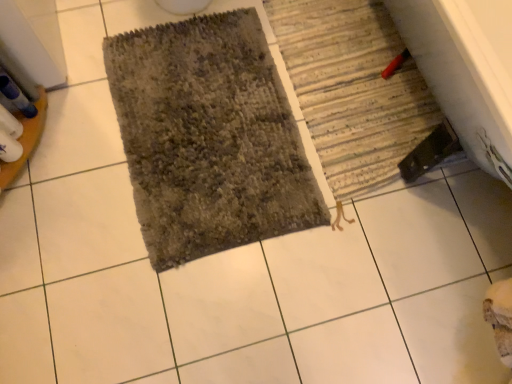
Identify the location of vacant area that is situated to the right of textured gray bath mat at center, which is the 2th bath mat in right-to-left order. (380, 167).